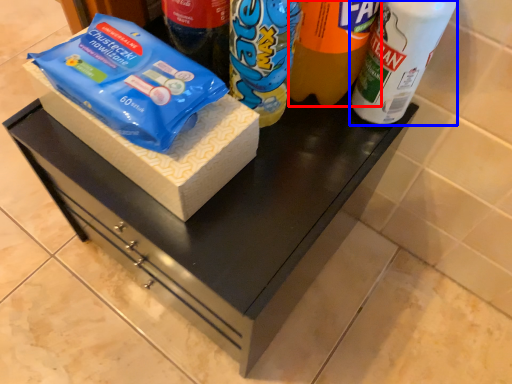
Question: Which of the following is the closest to the observer, drinking straw (highlighted by a red box) or bottle (highlighted by a blue box)?

Choices:
 (A) drinking straw
 (B) bottle

Answer: (A)